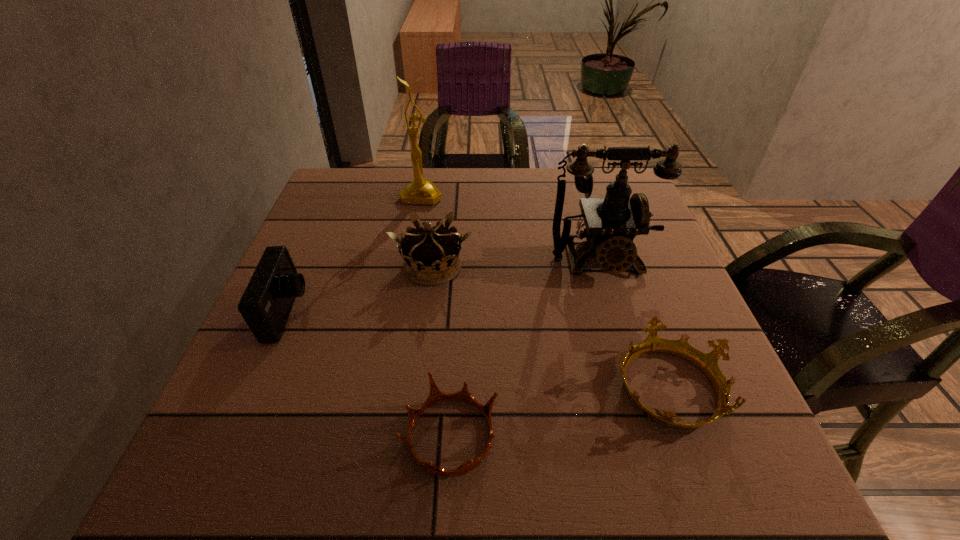
The image size is (960, 540). I want to click on vacant area in the image that satisfies the following two spatial constraints: 1. on the front-facing side of the tallest crown; 2. on the left side of the award, so click(x=408, y=267).

The height and width of the screenshot is (540, 960). Identify the location of free space that satisfies the following two spatial constraints: 1. on the front-facing side of the rightmost crown; 2. on the left side of the camera. (256, 386).

This screenshot has height=540, width=960. What are the coordinates of `vacant region that satisfies the following two spatial constraints: 1. on the rotary dial of the telephone; 2. on the left side of the rightmost crown` in the screenshot? It's located at (637, 386).

Where is `vacant space that satisfies the following two spatial constraints: 1. on the front-facing side of the farthest crown; 2. on the left side of the farthest object`? vacant space that satisfies the following two spatial constraints: 1. on the front-facing side of the farthest crown; 2. on the left side of the farthest object is located at coordinates (408, 267).